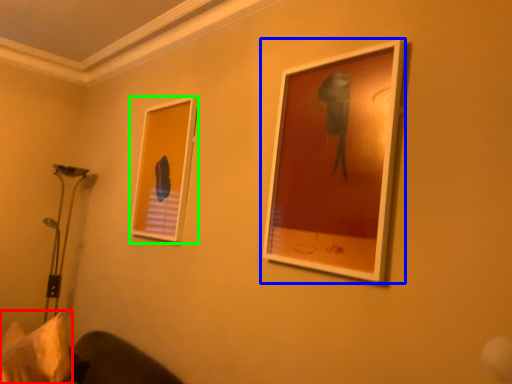
Question: Which object is the closest to the pillow (highlighted by a red box)? Choose among these: picture frame (highlighted by a blue box) or picture frame (highlighted by a green box).

Choices:
 (A) picture frame
 (B) picture frame

Answer: (B)